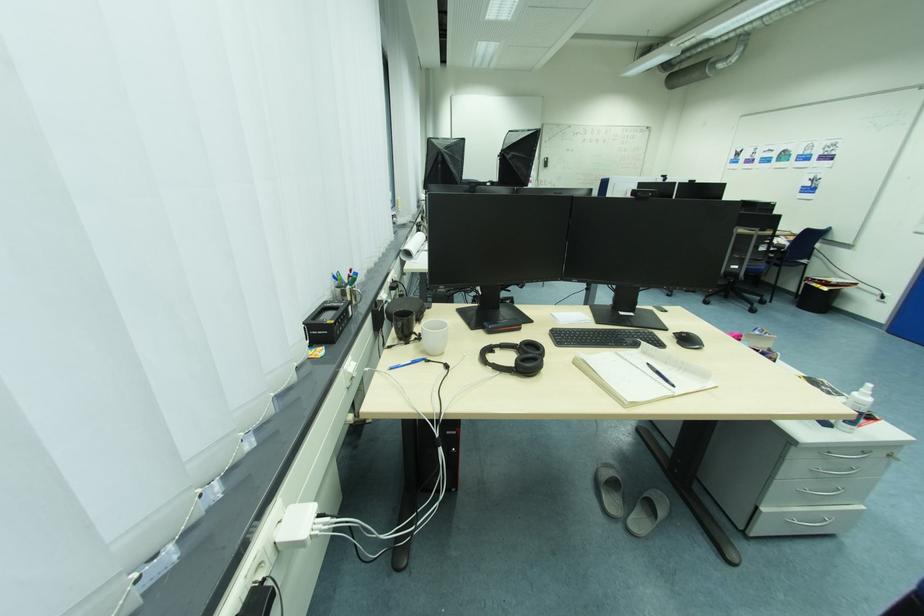
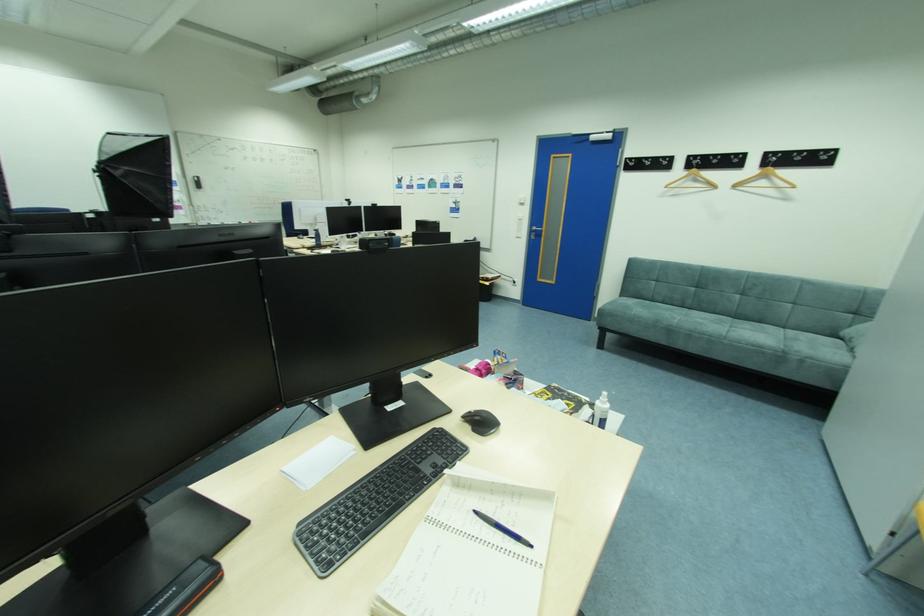
Question: Based on the continuous images, in which direction is the camera rotating? Reply with the corresponding letter.

Choices:
 (A) Left
 (B) Right
 (C) Up
 (D) Down

Answer: (B)